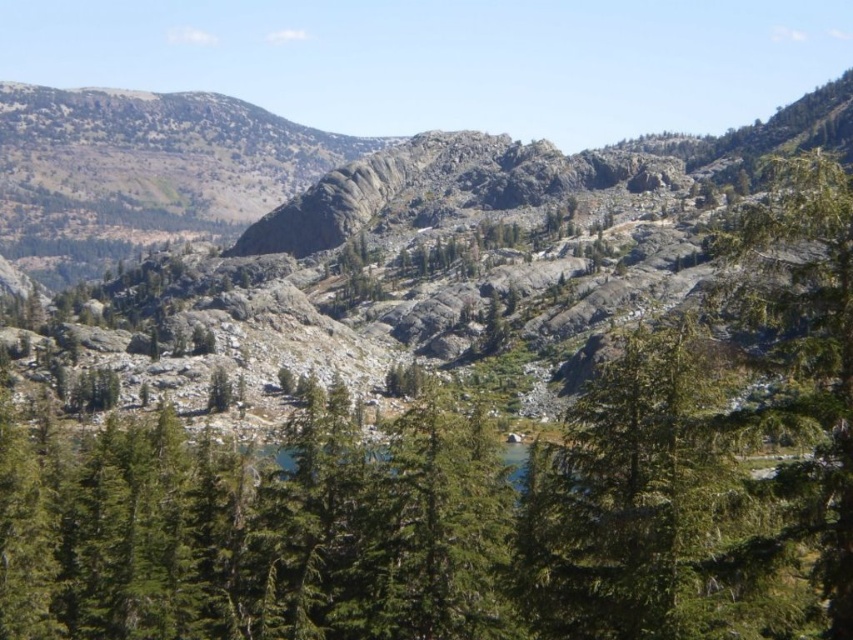
Question: Among these objects, which one is nearest to the camera?

Choices:
 (A) green textured tree at right
 (B) gray rocky mountain at center

Answer: (A)

Question: Is gray rocky mountain at center positioned behind green textured tree at right?

Choices:
 (A) no
 (B) yes

Answer: (B)

Question: Can you confirm if gray rocky mountain at center is thinner than green textured tree at right?

Choices:
 (A) yes
 (B) no

Answer: (B)

Question: Which point is closer to the camera?

Choices:
 (A) (44, 237)
 (B) (833, 486)

Answer: (B)

Question: Which of the following is the closest to the observer?

Choices:
 (A) green textured tree at right
 (B) gray rocky mountain at center

Answer: (A)

Question: Can you confirm if gray rocky mountain at center is positioned below green textured tree at right?

Choices:
 (A) yes
 (B) no

Answer: (B)